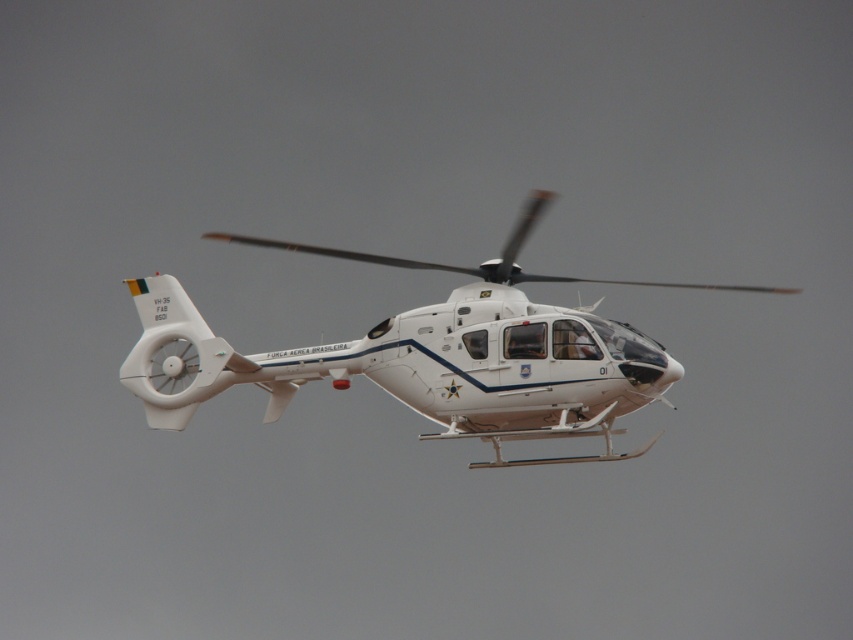
Which is below, white glossy helicopter at center or white matte propeller at center?

Positioned lower is white glossy helicopter at center.

Which of these two, white glossy helicopter at center or white matte propeller at center, stands shorter?

white matte propeller at center is shorter.

I want to click on white glossy helicopter at center, so click(428, 355).

Locate an element on the screen. The height and width of the screenshot is (640, 853). white glossy helicopter at center is located at coordinates (428, 355).